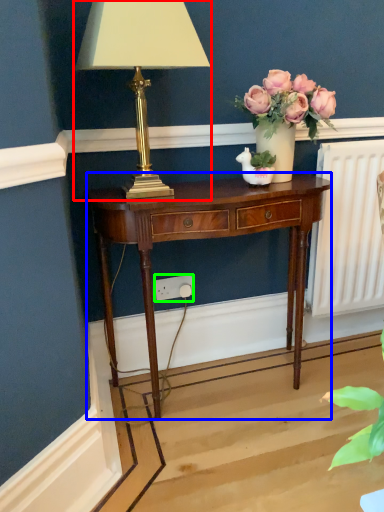
Question: Which object is the farthest from lamp (highlighted by a red box)? Choose among these: nightstand (highlighted by a blue box) or power outlet (highlighted by a green box).

Choices:
 (A) nightstand
 (B) power outlet

Answer: (B)